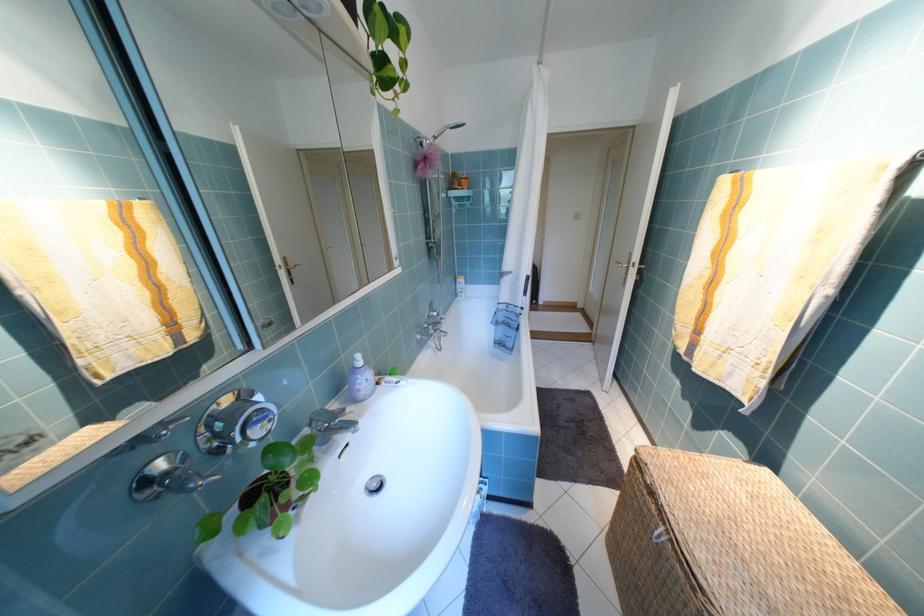
Find where to squeez the pink shower sponge. Please return your answer as a coordinate pair (x, y).

(427, 161)